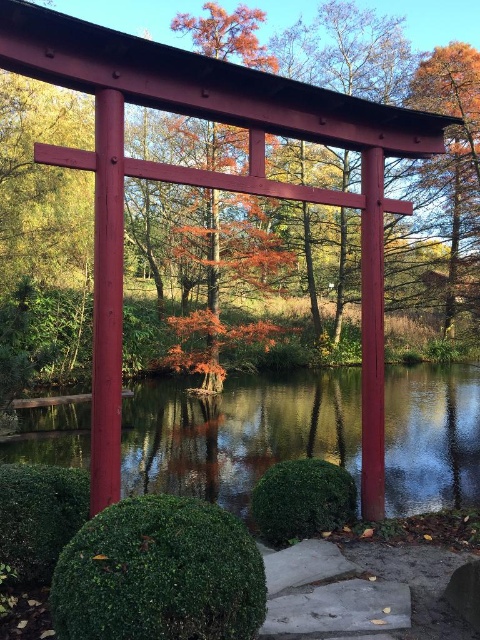
Between matte red wooden gate at center and orange matte tree at upper right, which one has less height?

With less height is orange matte tree at upper right.

Does point (328, 56) lie behind point (456, 80)?

Yes.

Where is `matte red wooden gate at center`? The image size is (480, 640). matte red wooden gate at center is located at coordinates (348, 52).

Does matte red wooden gate at center have a greater width compared to transparent glass lake at center?

Yes.

Can you confirm if matte red wooden gate at center is positioned above transparent glass lake at center?

Correct, matte red wooden gate at center is located above transparent glass lake at center.

The height and width of the screenshot is (640, 480). What do you see at coordinates (348, 52) in the screenshot?
I see `matte red wooden gate at center` at bounding box center [348, 52].

Locate an element on the screen. This screenshot has width=480, height=640. matte red wooden gate at center is located at coordinates (348, 52).

Is point (244, 148) closer to viewer compared to point (345, 160)?

Yes, point (244, 148) is in front of point (345, 160).

Which of these two, orange leafy tree at center or matte red wooden gate at upper center, stands taller?

Standing taller between the two is matte red wooden gate at upper center.

Is point (252, 204) farther from viewer compared to point (343, 22)?

No, it is not.

Find the location of a particular element. The height and width of the screenshot is (640, 480). orange leafy tree at center is located at coordinates (224, 275).